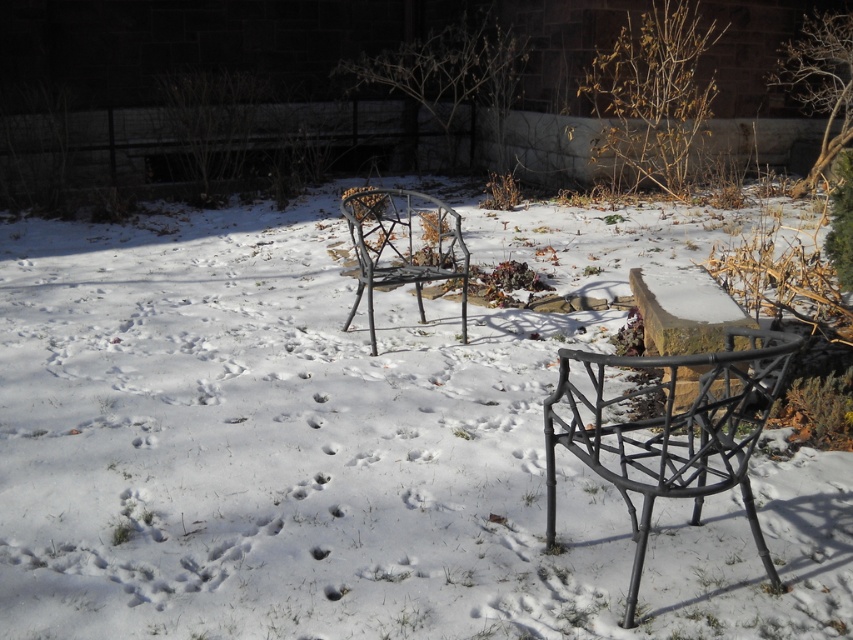
Does matte black chair at lower right have a greater height compared to metallic wire chair at center?

Incorrect, matte black chair at lower right's height is not larger of metallic wire chair at center's.

Is point (761, 544) positioned after point (413, 224)?

That is False.

Find the location of `matte black chair at lower right`. matte black chair at lower right is located at coordinates (x=668, y=428).

Based on the photo, does white matte snow at center appear under metallic wire chair at center?

Yes, white matte snow at center is below metallic wire chair at center.

Does white matte snow at center have a greater height compared to metallic wire chair at center?

No, white matte snow at center is not taller than metallic wire chair at center.

Is point (645, 209) in front of point (407, 193)?

That is True.

The width and height of the screenshot is (853, 640). What are the coordinates of `white matte snow at center` in the screenshot? It's located at (339, 458).

Does white matte snow at center appear on the right side of matte black chair at lower right?

No, white matte snow at center is not to the right of matte black chair at lower right.

Does white matte snow at center have a lesser height compared to matte black chair at lower right?

Yes.

This screenshot has width=853, height=640. Describe the element at coordinates (339, 458) in the screenshot. I see `white matte snow at center` at that location.

Identify the location of white matte snow at center. (339, 458).